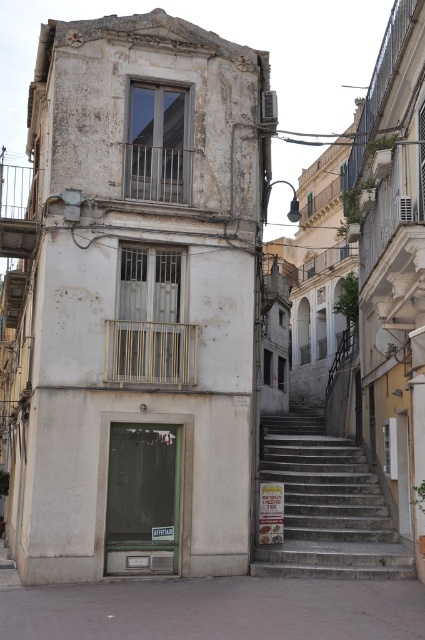
Can you confirm if concrete pavement at lower center is bigger than stone stairs at center?

No, concrete pavement at lower center is not bigger than stone stairs at center.

Who is more distant from viewer, [328,632] or [278,461]?

Positioned behind is point [278,461].

Locate an element on the screen. This screenshot has height=640, width=425. concrete pavement at lower center is located at coordinates (215, 609).